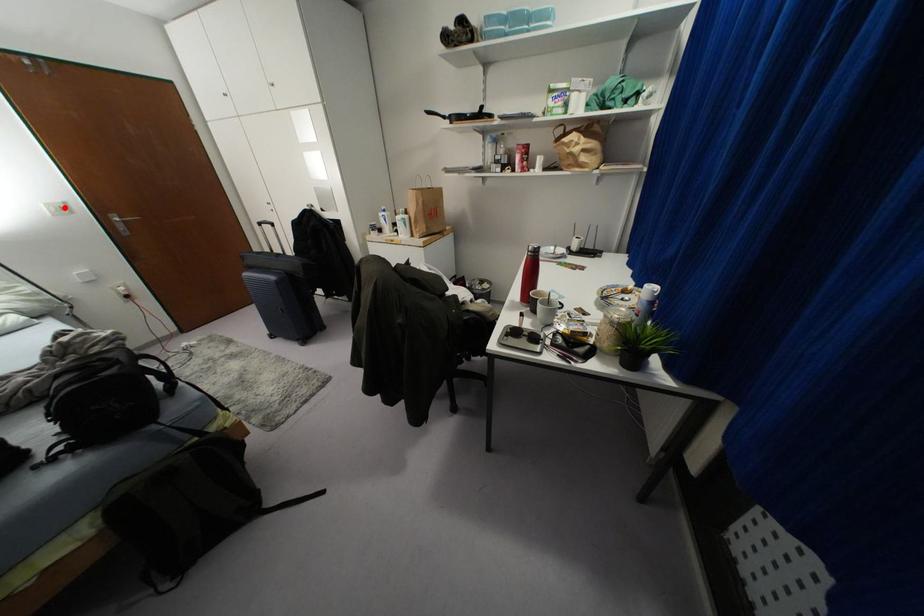
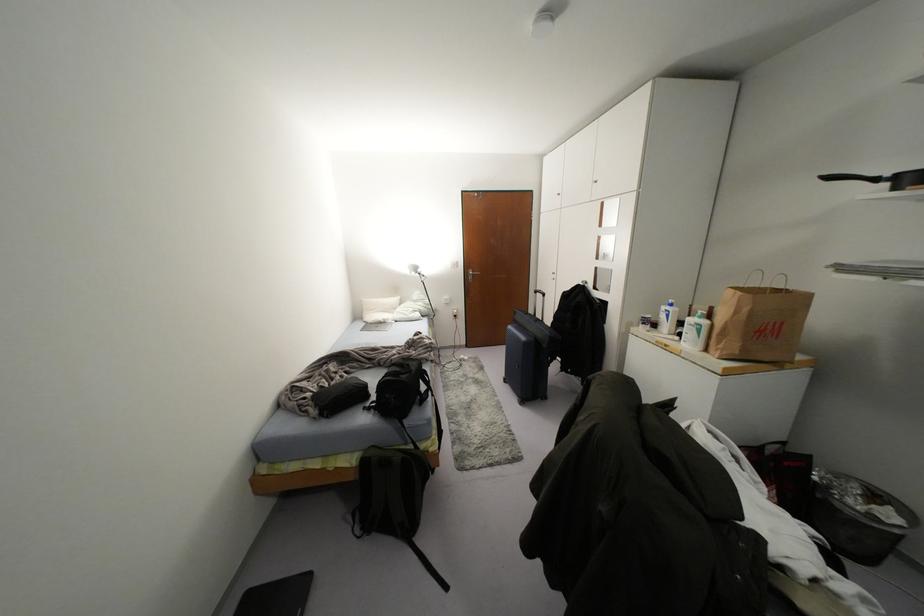
Question: I am providing you with two images of the same scene from different viewpoints. A red point is shown in image1. For the corresponding object point in image2, is it positioned nearer or farther from the camera?

Choices:
 (A) Nearer
 (B) Farther

Answer: (A)